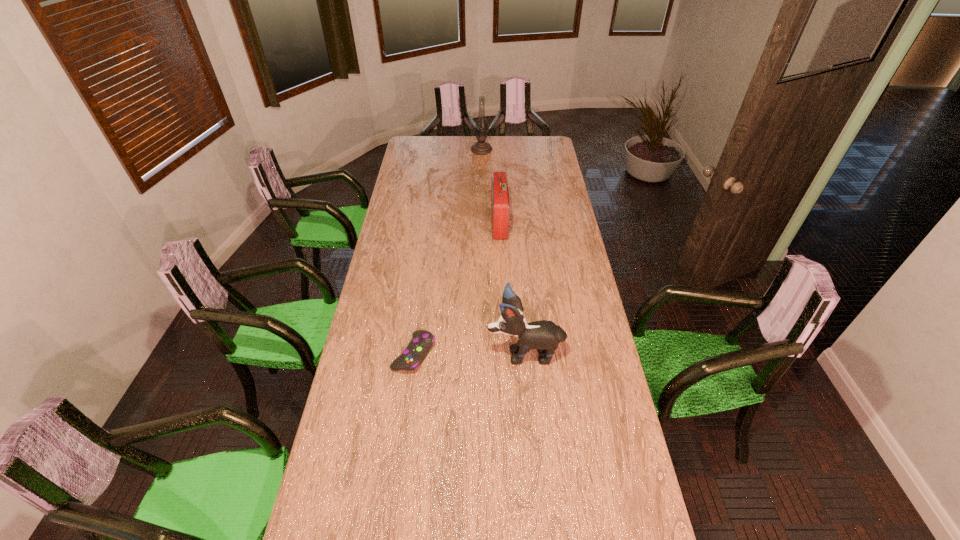
This screenshot has height=540, width=960. Identify the location of vacant space situated 0.240m on the side of the first-aid kit with the first aid cross symbol. (443, 223).

This screenshot has height=540, width=960. Identify the location of free space located on the side of the first-aid kit with the first aid cross symbol. (427, 223).

This screenshot has width=960, height=540. I want to click on free space located on the side of the first-aid kit with the first aid cross symbol, so click(x=415, y=223).

Locate an element on the screen. The height and width of the screenshot is (540, 960). vacant space located on the back of the control is located at coordinates (423, 282).

Image resolution: width=960 pixels, height=540 pixels. I want to click on object at the far edge, so click(x=481, y=147).

What are the coordinates of `object present at the left edge` in the screenshot? It's located at (418, 348).

Identify the location of object at the right edge. tap(543, 335).

Find the location of `vacant region at the left edge of the desktop`. vacant region at the left edge of the desktop is located at coordinates (391, 376).

Locate an element on the screen. This screenshot has width=960, height=540. free spot at the right edge of the desktop is located at coordinates (571, 221).

Locate an element on the screen. The width and height of the screenshot is (960, 540). free area in between the oil lamp and the third nearest object is located at coordinates (491, 187).